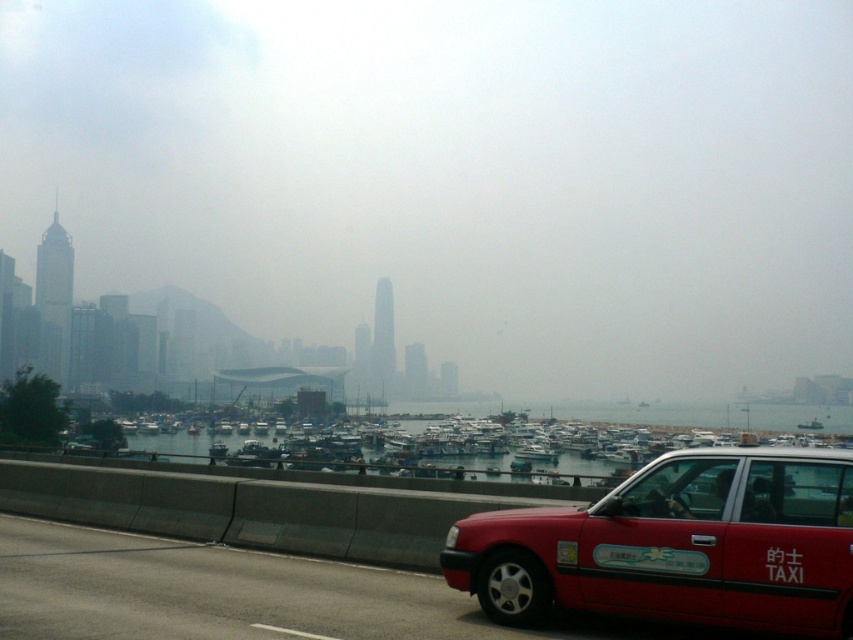
Consider the image. Who is more forward, (358, 272) or (712, 493)?

Point (712, 493)

Between point (599, 160) and point (851, 506), which one is positioned behind?

The point (599, 160) is more distant.

Identify the location of foggy haze at center. (457, 177).